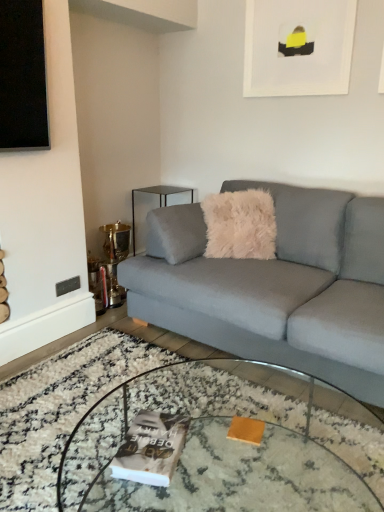
You are a GUI agent. You are given a task and a screenshot of the screen. Output one action in this format:
    pyautogui.click(x=<x>, y=<y>)
    Task: Click on the free point above matte gray magazine at center (from a real-world perspective)
    
    Given the screenshot: What is the action you would take?
    pyautogui.click(x=147, y=442)